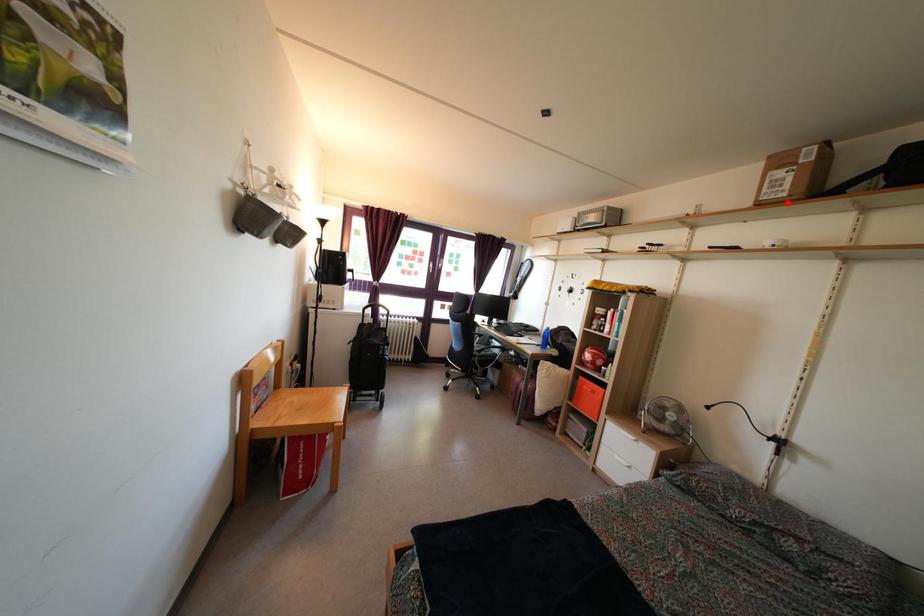
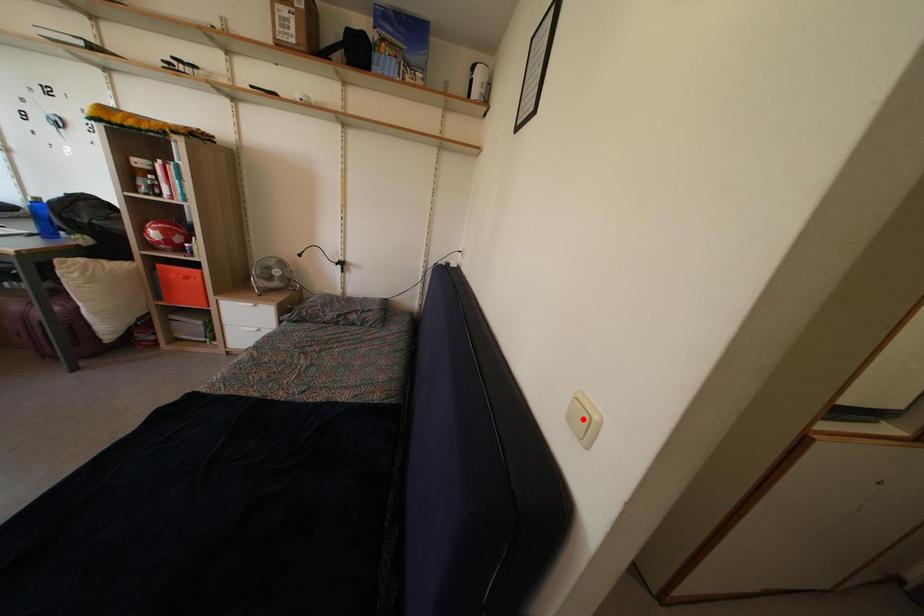
I am providing you with two images of the same scene from different viewpoints. A red point is marked on the first image and another point is marked on the second image. Does the point marked in image1 correspond to the same location as the one in image2?

No